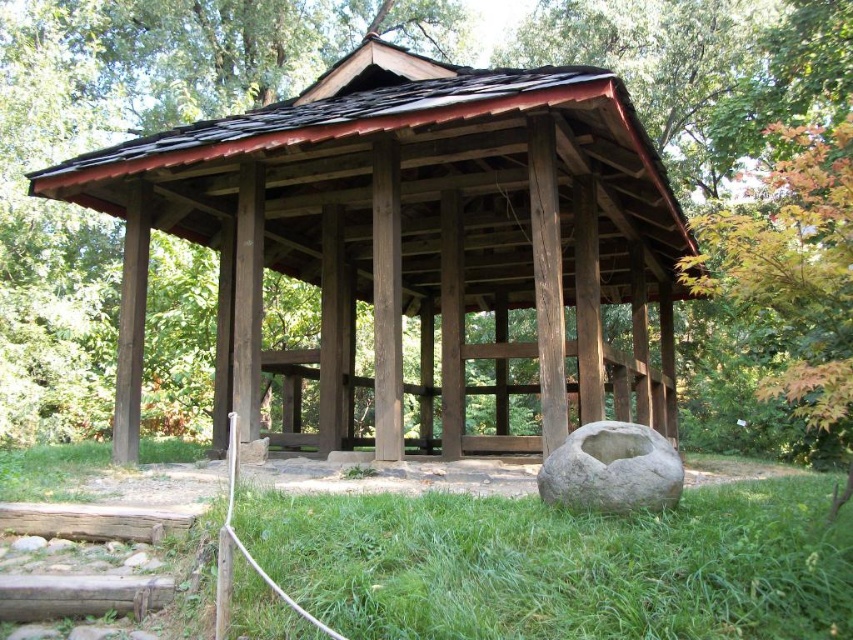
You are standing in front of the traditional wooden pavilion and notice the green grass at lower center and the gray stone bowl at lower center. Which object is positioned higher relative to the other?

The gray stone bowl at lower center is positioned higher than the green grass at lower center since the grass is located below it.

You are standing outside the brown wooden gazebo at center and want to place a small potted plant on the gray stone bowl at lower center. Can you place it directly under the gazebo without moving the gazebo?

The brown wooden gazebo at center is positioned over gray stone bowl at lower center, so yes, placing the potted plant on the gray stone bowl at lower center would place it directly under the gazebo without needing to move the gazebo.